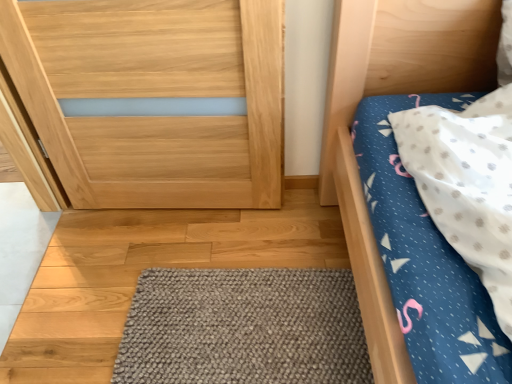
Find the location of `vacant location below natural wood door at upper left (from a real-world perspective)`. vacant location below natural wood door at upper left (from a real-world perspective) is located at coordinates (191, 210).